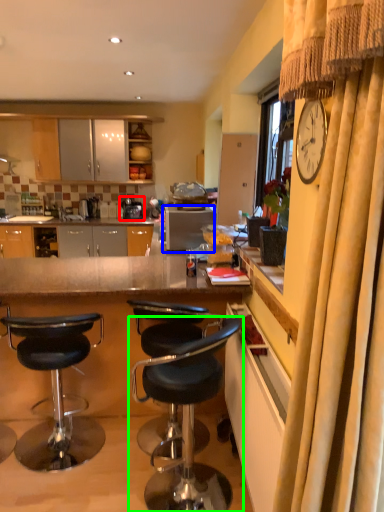
Question: Considering the real-world distances, which object is farthest from coffee machine (highlighted by a red box)? appliance (highlighted by a blue box) or chair (highlighted by a green box)?

Choices:
 (A) appliance
 (B) chair

Answer: (B)